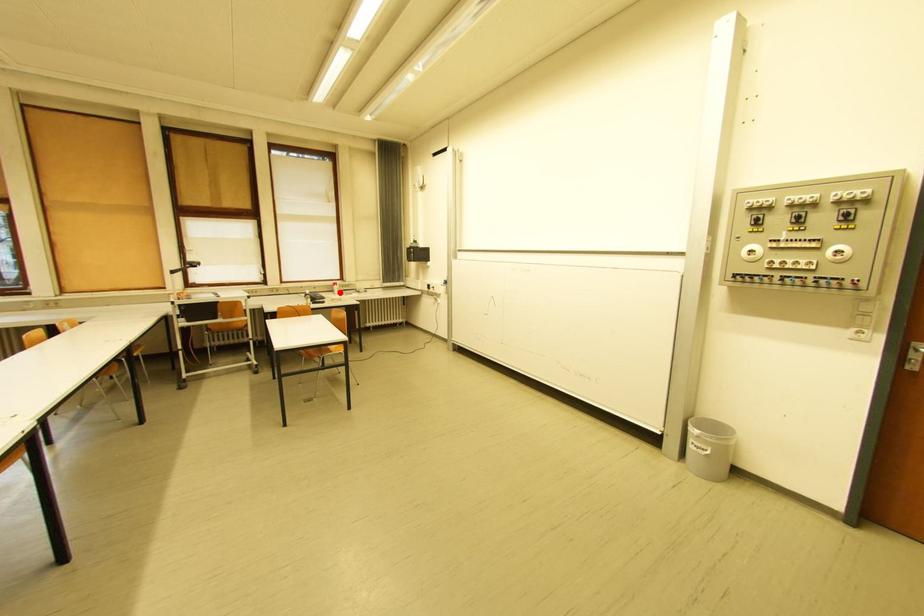
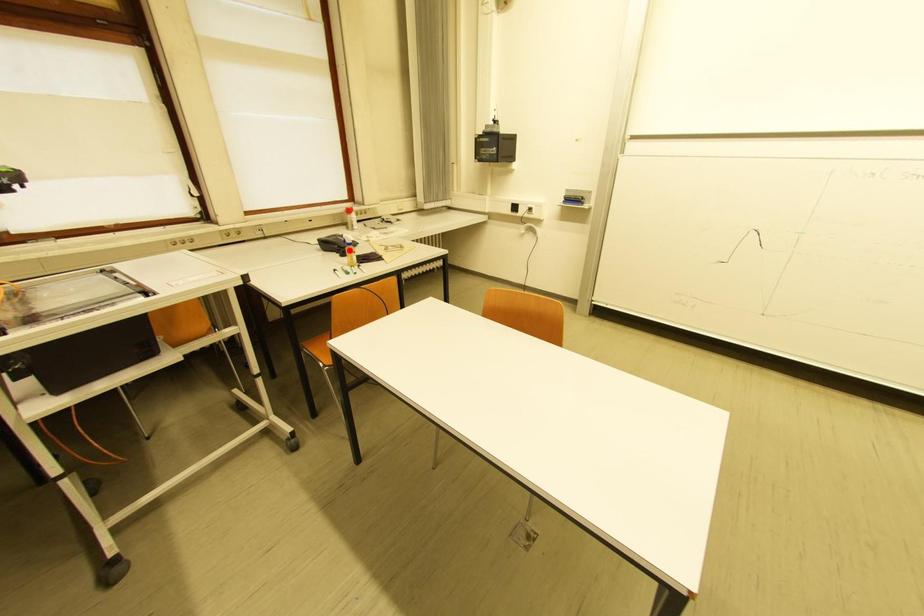
I am providing you with two images of the same scene from different viewpoints. A red point is marked on the first image and another point is marked on the second image. Is the marked point in image1 the same physical position as the marked point in image2?

No